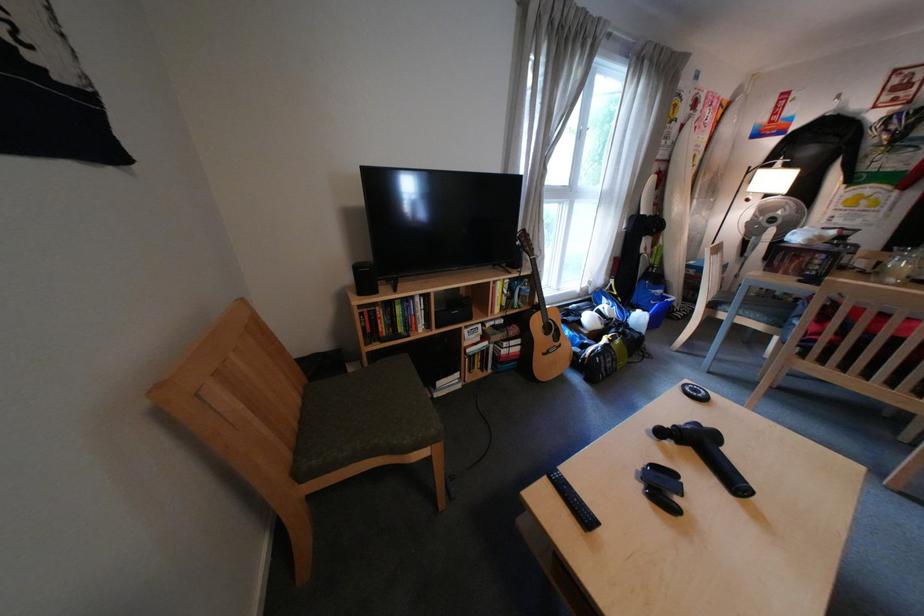
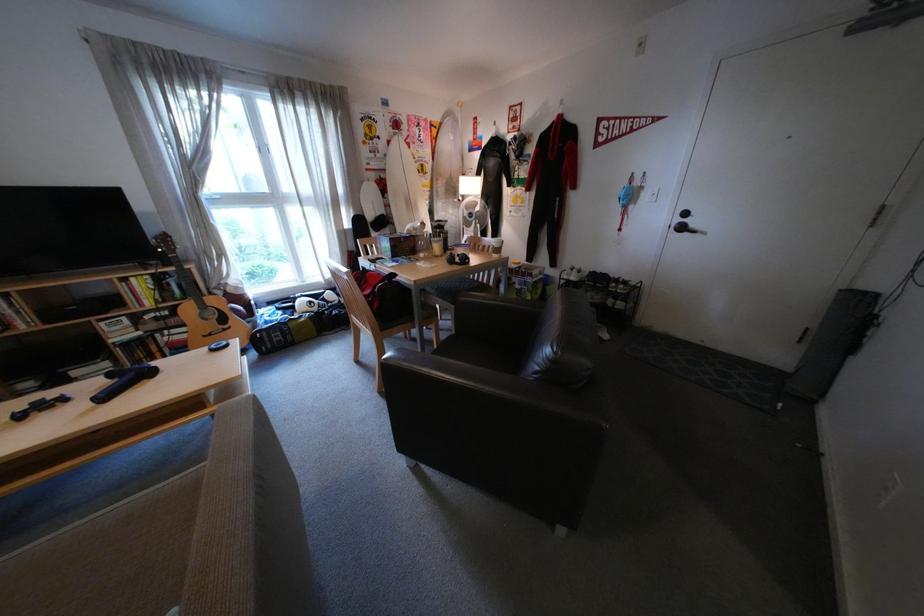
Locate, in the second image, the point that corresponds to pixel 682 144 in the first image.

(392, 156)